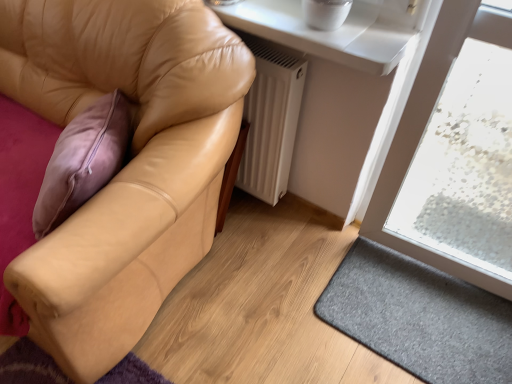
Question: Is white matte radiator at lower center taller than gray felt doormat at lower right?

Choices:
 (A) yes
 (B) no

Answer: (A)

Question: Is white matte radiator at lower center closer to the viewer compared to gray felt doormat at lower right?

Choices:
 (A) yes
 (B) no

Answer: (B)

Question: Is white matte radiator at lower center turned away from gray felt doormat at lower right?

Choices:
 (A) yes
 (B) no

Answer: (B)

Question: From a real-world perspective, is white matte radiator at lower center under gray felt doormat at lower right?

Choices:
 (A) no
 (B) yes

Answer: (A)

Question: Would you say white matte radiator at lower center is a long distance from gray felt doormat at lower right?

Choices:
 (A) yes
 (B) no

Answer: (B)

Question: Is white matte radiator at lower center further to the viewer compared to gray felt doormat at lower right?

Choices:
 (A) no
 (B) yes

Answer: (B)

Question: From the image's perspective, is white matte radiator at lower center on white glossy window sill at upper center?

Choices:
 (A) yes
 (B) no

Answer: (B)

Question: Is white matte radiator at lower center shorter than white glossy window sill at upper center?

Choices:
 (A) no
 (B) yes

Answer: (A)

Question: From the image's perspective, is white matte radiator at lower center under white glossy window sill at upper center?

Choices:
 (A) yes
 (B) no

Answer: (A)

Question: Is the position of white matte radiator at lower center more distant than that of white glossy window sill at upper center?

Choices:
 (A) no
 (B) yes

Answer: (B)

Question: Is white matte radiator at lower center facing towards white glossy window sill at upper center?

Choices:
 (A) yes
 (B) no

Answer: (B)

Question: Are white matte radiator at lower center and white glossy window sill at upper center located far from each other?

Choices:
 (A) yes
 (B) no

Answer: (B)

Question: From the image's perspective, is gray felt doormat at lower right beneath white glossy window sill at upper center?

Choices:
 (A) yes
 (B) no

Answer: (A)